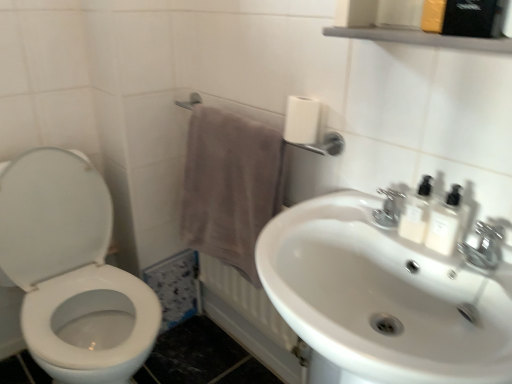
The image size is (512, 384). What do you see at coordinates (447, 223) in the screenshot?
I see `white opaque bottles at upper right, arranged as the 1th mouthwash when viewed from the right` at bounding box center [447, 223].

The height and width of the screenshot is (384, 512). In order to click on metallic gray shelf at upper center in this screenshot , I will do `click(422, 38)`.

What do you see at coordinates (484, 247) in the screenshot? The image size is (512, 384). I see `chrome metallic faucet at upper right` at bounding box center [484, 247].

The width and height of the screenshot is (512, 384). In order to click on white matte toilet paper at upper right in this screenshot , I will do [x=301, y=120].

Which of these two, white matte toilet paper at upper right or white glossy sink at center, is bigger?

white glossy sink at center.

Looking at this image, can you confirm if white matte toilet paper at upper right is shorter than white glossy sink at center?

Indeed, white matte toilet paper at upper right has a lesser height compared to white glossy sink at center.

From the image's perspective, is white matte toilet paper at upper right above white glossy sink at center?

Correct, white matte toilet paper at upper right appears higher than white glossy sink at center in the image.

Are white matte toilet paper at upper right and white glossy sink at center far apart?

That's not correct — white matte toilet paper at upper right is a little close to white glossy sink at center.

Between white glossy toilet at left and brown fabric towel at lower center, which one has smaller size?

With smaller size is brown fabric towel at lower center.

From a real-world perspective, relative to brown fabric towel at lower center, is white glossy toilet at left vertically above or below?

Clearly, from a real-world perspective, white glossy toilet at left is above brown fabric towel at lower center.

Does white glossy toilet at left turn towards brown fabric towel at lower center?

No, white glossy toilet at left is not facing towards brown fabric towel at lower center.

Considering the positions of points (50, 286) and (239, 319), is point (50, 286) closer to camera compared to point (239, 319)?

Yes, point (50, 286) is in front of point (239, 319).

Is metallic gray shelf at upper center facing towards brown fabric towel at lower center?

No, metallic gray shelf at upper center is not turned towards brown fabric towel at lower center.

From the picture: Which is correct: metallic gray shelf at upper center is inside brown fabric towel at lower center, or outside of it?

metallic gray shelf at upper center lies outside brown fabric towel at lower center.

From the image's perspective, between metallic gray shelf at upper center and brown fabric towel at lower center, who is located below?

brown fabric towel at lower center appears lower in the image.

Can you confirm if metallic gray shelf at upper center is positioned to the right of brown fabric towel at lower center?

Indeed, metallic gray shelf at upper center is positioned on the right side of brown fabric towel at lower center.

Based on the photo, from the image's perspective, who appears lower, chrome metallic faucet at upper right or white matte bottle at right, which is the second mouthwash from right to left?

chrome metallic faucet at upper right appears lower in the image.

Can you confirm if chrome metallic faucet at upper right is thinner than white matte bottle at right, which is the second mouthwash from right to left?

No, chrome metallic faucet at upper right is not thinner than white matte bottle at right, which is the second mouthwash from right to left.

Is chrome metallic faucet at upper right not near white matte bottle at right, which is the second mouthwash from right to left?

That's not correct — chrome metallic faucet at upper right is a little close to white matte bottle at right, which is the second mouthwash from right to left.

Which object is further away from the camera, chrome metallic faucet at upper right or white matte bottle at right, which is the second mouthwash from right to left?

white matte bottle at right, which is the second mouthwash from right to left.

Could you tell me if white opaque bottles at upper right, which is the second mouthwash in left-to-right order, is turned towards white glossy toilet at left?

No, white opaque bottles at upper right, which is the second mouthwash in left-to-right order, is not aimed at white glossy toilet at left.

Consider the image. From the image's perspective, which object appears higher, white opaque bottles at upper right, arranged as the 1th mouthwash when viewed from the right, or white glossy toilet at left?

white opaque bottles at upper right, arranged as the 1th mouthwash when viewed from the right, from the image's perspective.

Starting from the white glossy toilet at left, which mouthwash is the 2nd one in front? Please provide its 2D coordinates.

[(447, 223)]

Which is in front, point (429, 240) or point (61, 165)?

The point (429, 240) is closer to the camera.

Can you confirm if beige cotton towel at upper center is taller than brown fabric towel at lower center?

No.

Where is `radiator on the right of beige cotton towel at upper center`? radiator on the right of beige cotton towel at upper center is located at coordinates click(245, 300).

Which is closer, [188,185] or [261,321]?

The point [188,185] is more forward.

From a real-world perspective, which is physically above, beige cotton towel at upper center or brown fabric towel at lower center?

In real-world perspective, beige cotton towel at upper center is above.

Is metallic gray shelf at upper center aimed at white matte bottle at right, which is the first mouthwash in left-to-right order?

No, metallic gray shelf at upper center is not oriented towards white matte bottle at right, which is the first mouthwash in left-to-right order.

Is metallic gray shelf at upper center surrounding white matte bottle at right, which is the second mouthwash from right to left?

No, metallic gray shelf at upper center does not contain white matte bottle at right, which is the second mouthwash from right to left.

Considering the relative sizes of metallic gray shelf at upper center and white matte bottle at right, which is the second mouthwash from right to left, in the image provided, is metallic gray shelf at upper center wider than white matte bottle at right, which is the second mouthwash from right to left,?

Correct, the width of metallic gray shelf at upper center exceeds that of white matte bottle at right, which is the second mouthwash from right to left.

From the picture: Is metallic gray shelf at upper center taller than white matte bottle at right, which is the first mouthwash in left-to-right order?

Incorrect, the height of metallic gray shelf at upper center is not larger of that of white matte bottle at right, which is the first mouthwash in left-to-right order.

Identify the location of sink below the white matte toilet paper at upper right (from the image's perspective). The height and width of the screenshot is (384, 512). (380, 299).

Identify the location of toilet above the brown fabric towel at lower center (from the image's perspective). The image size is (512, 384). (72, 271).

Considering their positions, is white matte toilet paper at upper right positioned further to white glossy toilet at left than metallic gray shelf at upper center?

metallic gray shelf at upper center is positioned further to the anchor white glossy toilet at left.

Based on the photo, estimate the real-world distances between objects in this image. Which object is further from white matte toilet paper at upper right, beige cotton towel at upper center or brown fabric towel at lower center?

Based on the image, brown fabric towel at lower center appears to be further to white matte toilet paper at upper right.

When comparing their distances from metallic gray shelf at upper center, does white glossy sink at center or white matte toilet paper at upper right seem further?

Among the two, white glossy sink at center is located further to metallic gray shelf at upper center.

Which object lies nearer to the anchor point metallic gray shelf at upper center, white glossy toilet at left or white glossy sink at center?

The object closer to metallic gray shelf at upper center is white glossy sink at center.

Estimate the real-world distances between objects in this image. Which object is closer to white opaque bottles at upper right, which is the second mouthwash in left-to-right order, beige cotton towel at upper center or white glossy sink at center?

white glossy sink at center is positioned closer to the anchor white opaque bottles at upper right, which is the second mouthwash in left-to-right order.

Looking at the image, which one is located further to brown fabric towel at lower center, metallic gray shelf at upper center or white matte bottle at right, which is the second mouthwash from right to left?

Among the two, metallic gray shelf at upper center is located further to brown fabric towel at lower center.

From the image, which object appears to be nearer to white glossy sink at center, white matte toilet paper at upper right or white matte bottle at right, which is the first mouthwash in left-to-right order?

The object closer to white glossy sink at center is white matte bottle at right, which is the first mouthwash in left-to-right order.

From the image, which object appears to be farther from beige cotton towel at upper center, white glossy toilet at left or chrome metallic faucet at upper right?

chrome metallic faucet at upper right.

At what (x,y) coordinates should I click in order to perform the action: click on balustrade between white glossy toilet at left and white opaque bottles at upper right, arranged as the 1th mouthwash when viewed from the right. Please return your answer as a coordinate pair (x, y). Looking at the image, I should click on (422, 38).

Find the location of a particular element. toilet paper between metallic gray shelf at upper center and beige cotton towel at upper center in the front-back direction is located at coordinates (301, 120).

Locate an element on the screen. This screenshot has height=384, width=512. toilet paper located between white glossy toilet at left and white matte bottle at right, which is the second mouthwash from right to left, in the left-right direction is located at coordinates (301, 120).

Find the location of a particular element. The image size is (512, 384). sink situated between white glossy toilet at left and metallic gray shelf at upper center from left to right is located at coordinates (380, 299).